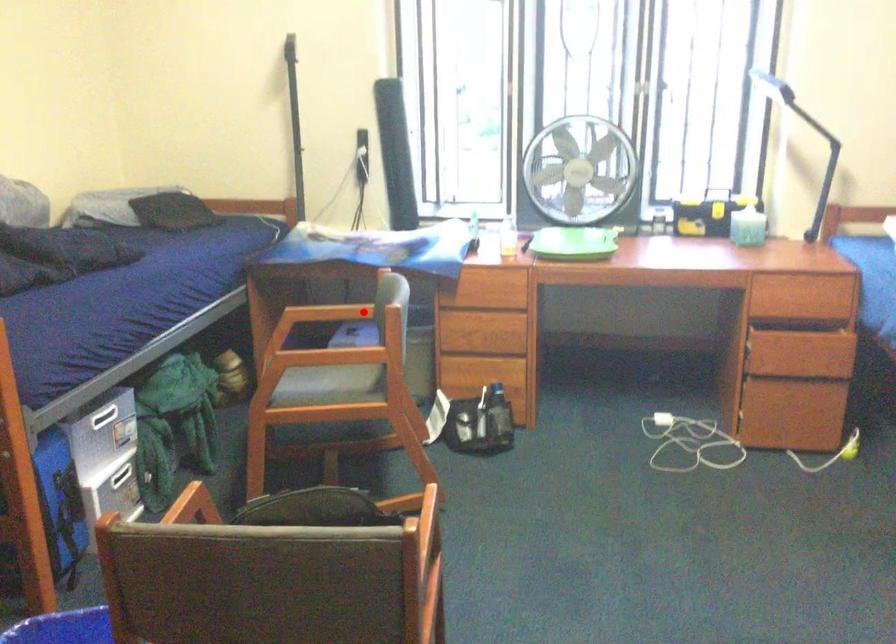
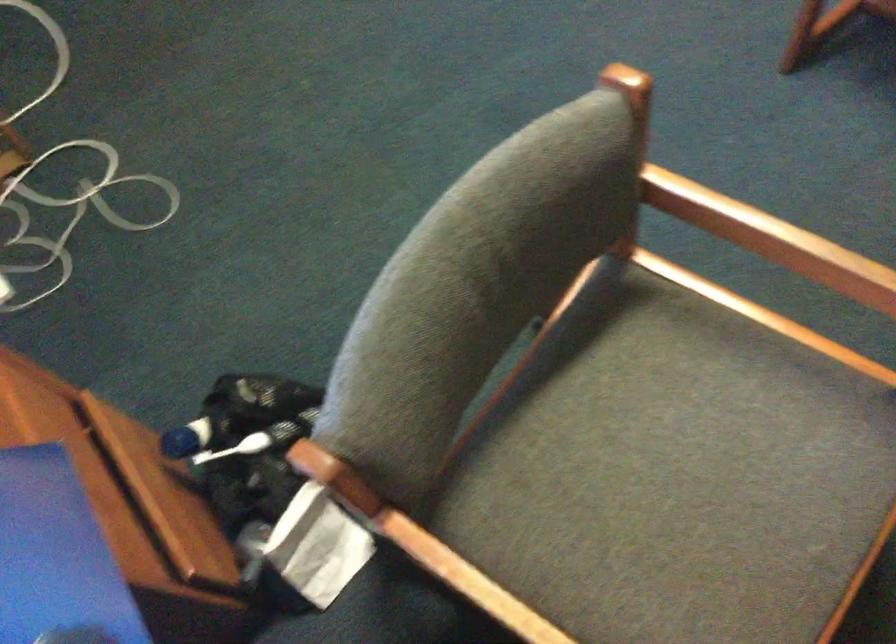
Question: I am providing you with two images of the same scene from different viewpoints. A red point is shown in image1. For the corresponding object point in image2, is it positioned nearer or farther from the camera?

Choices:
 (A) Nearer
 (B) Farther

Answer: (A)